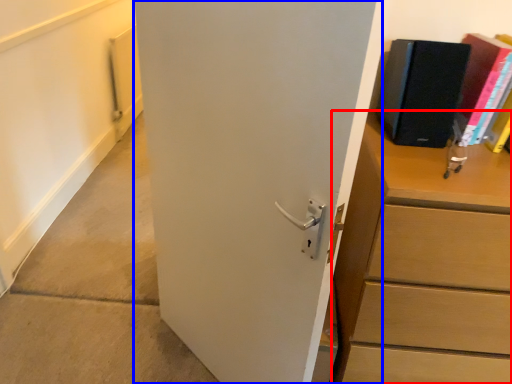
Question: Among these objects, which one is nearest to the camera, chest of drawers (highlighted by a red box) or door (highlighted by a blue box)?

Choices:
 (A) chest of drawers
 (B) door

Answer: (B)